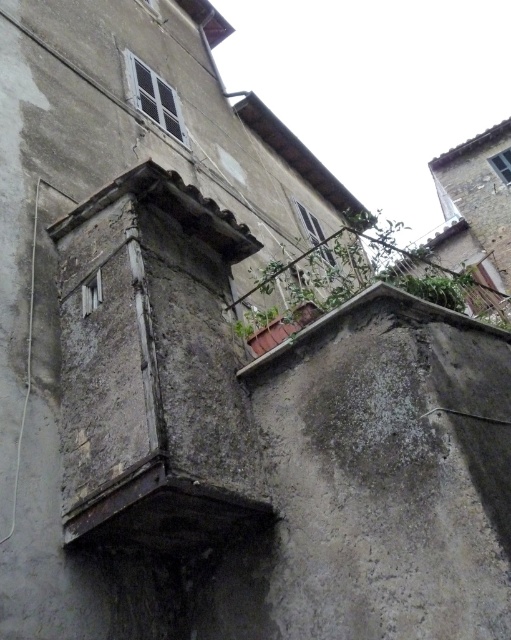
Question: Can you confirm if rustic concrete ledge at center is positioned below green leafy plant at upper right?

Choices:
 (A) no
 (B) yes

Answer: (B)

Question: Which of the following is the farthest from the observer?

Choices:
 (A) (391, 244)
 (B) (246, 365)

Answer: (A)

Question: Which object is closer to the camera taking this photo?

Choices:
 (A) rustic concrete ledge at center
 (B) green leafy plant at upper right

Answer: (A)

Question: Is rustic concrete ledge at center to the left of green leafy plant at upper right from the viewer's perspective?

Choices:
 (A) no
 (B) yes

Answer: (B)

Question: Can you confirm if rustic concrete ledge at center is bigger than green leafy plant at upper right?

Choices:
 (A) yes
 (B) no

Answer: (B)